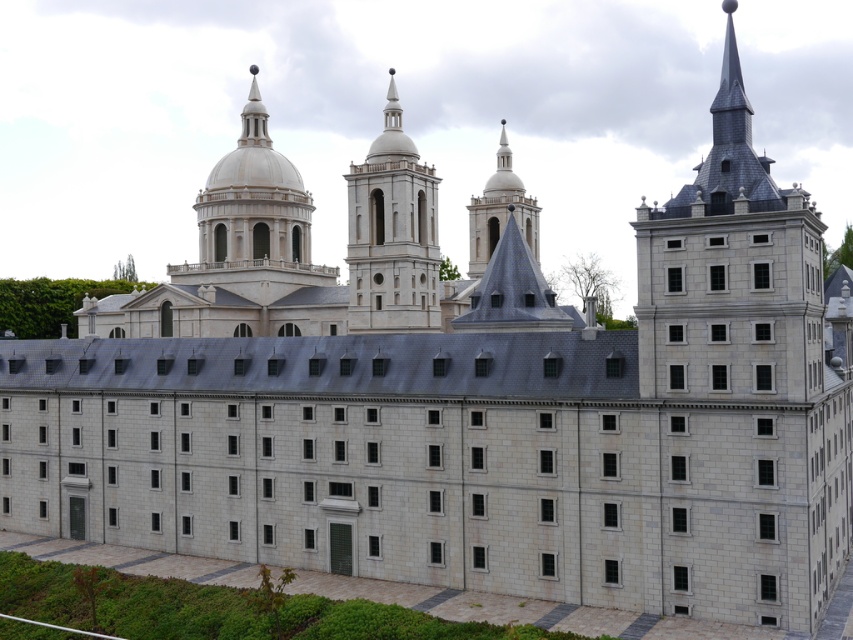
Which is behind, point (743, 413) or point (480, 228)?

Point (480, 228)

Who is positioned more to the right, gray stone tower at upper center or smooth gray steeple at center?

From the viewer's perspective, gray stone tower at upper center appears more on the right side.

The width and height of the screenshot is (853, 640). What do you see at coordinates (741, 387) in the screenshot?
I see `gray stone tower at upper center` at bounding box center [741, 387].

This screenshot has width=853, height=640. I want to click on gray stone tower at upper center, so click(741, 387).

In the scene shown: Can you confirm if white stone tower at center is bigger than smooth gray steeple at center?

No, white stone tower at center is not bigger than smooth gray steeple at center.

Does point (405, 195) come closer to viewer compared to point (509, 204)?

That is True.

Locate an element on the screen. This screenshot has width=853, height=640. white stone tower at center is located at coordinates (392, 234).

From the picture: Can you confirm if gray stone tower at upper center is positioned to the left of white stone tower at center?

No, gray stone tower at upper center is not to the left of white stone tower at center.

Image resolution: width=853 pixels, height=640 pixels. I want to click on gray stone tower at upper center, so click(x=741, y=387).

I want to click on gray stone tower at upper center, so click(741, 387).